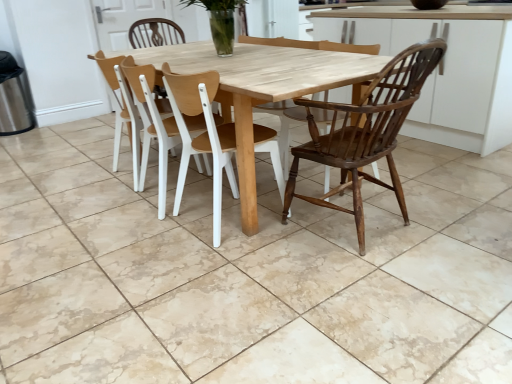
In order to click on free spot in front of light wood table at center in this screenshot , I will do `click(224, 291)`.